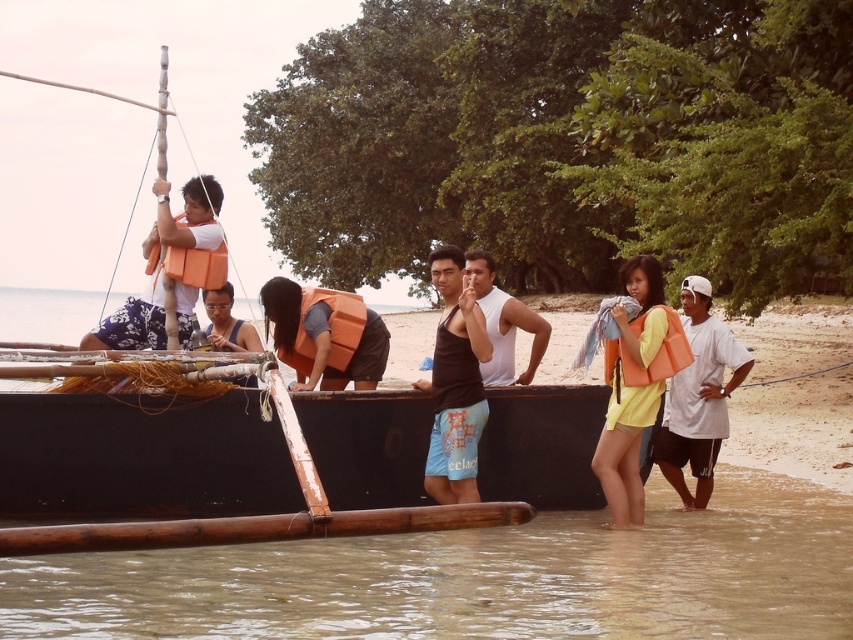
Does black tank top at center appear under matte orange life vest at center?

Yes, black tank top at center is below matte orange life vest at center.

Can you confirm if black tank top at center is shorter than matte orange life vest at center?

Incorrect, black tank top at center's height does not fall short of matte orange life vest at center's.

Where is `black tank top at center`? black tank top at center is located at coordinates (456, 384).

Locate an element on the screen. black tank top at center is located at coordinates click(x=456, y=384).

Where is `black rubber boat at center`? This screenshot has width=853, height=640. black rubber boat at center is located at coordinates [793, 428].

The height and width of the screenshot is (640, 853). Describe the element at coordinates (793, 428) in the screenshot. I see `black rubber boat at center` at that location.

Find the location of `black rubber boat at center`. black rubber boat at center is located at coordinates (793, 428).

Between orange life vest at right and orange life vest at left, which one is positioned higher?

orange life vest at left is above.

Who is lower down, orange life vest at right or orange life vest at left?

Positioned lower is orange life vest at right.

Describe the element at coordinates (699, 396) in the screenshot. I see `orange life vest at right` at that location.

At what (x,y) coordinates should I click in order to perform the action: click on orange life vest at right. Please return your answer as a coordinate pair (x, y). Looking at the image, I should click on (699, 396).